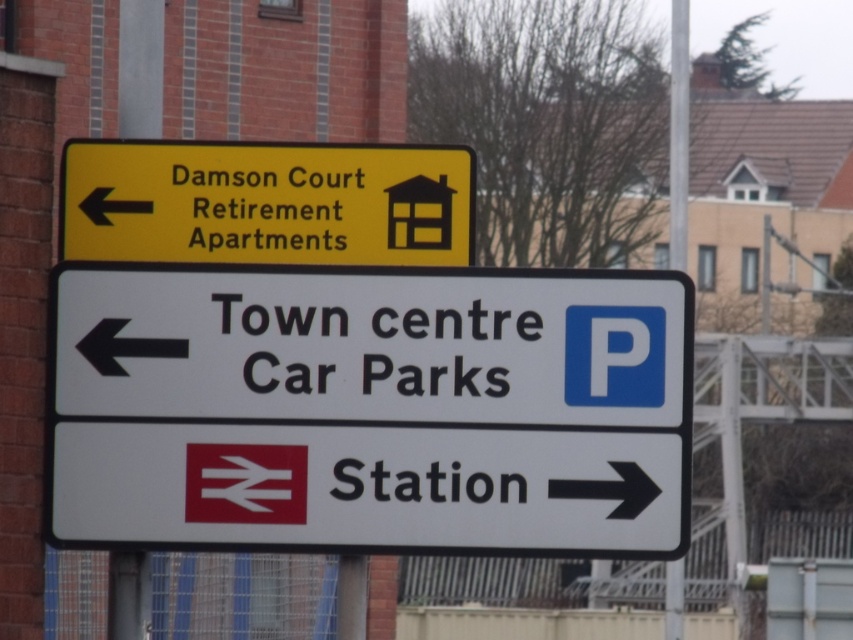
In the scene shown: Who is more forward, (74, 232) or (683, 224)?

Point (74, 232) is in front.

Can you confirm if yellow matte sign at upper left is smaller than white plastic pole at upper center?

Yes.

Describe the element at coordinates (265, 202) in the screenshot. Image resolution: width=853 pixels, height=640 pixels. I see `yellow matte sign at upper left` at that location.

The width and height of the screenshot is (853, 640). What are the coordinates of `yellow matte sign at upper left` in the screenshot? It's located at (265, 202).

Does white plastic sign at left appear over white plastic pole at upper center?

Yes.

Which is behind, point (438, 412) or point (685, 198)?

The point (685, 198) is behind.

Does point (525, 385) come closer to viewer compared to point (683, 19)?

That is True.

At what (x,y) coordinates should I click in order to perform the action: click on white plastic sign at left. Please return your answer as a coordinate pair (x, y). Image resolution: width=853 pixels, height=640 pixels. Looking at the image, I should click on (372, 344).

Which is more to the right, white plastic sign at left or yellow matte sign at upper left?

white plastic sign at left is more to the right.

Can you confirm if white plastic sign at left is positioned below yellow matte sign at upper left?

Yes.

Measure the distance between white plastic sign at left and camera.

white plastic sign at left and camera are 7.00 meters apart.

I want to click on white plastic sign at left, so click(372, 344).